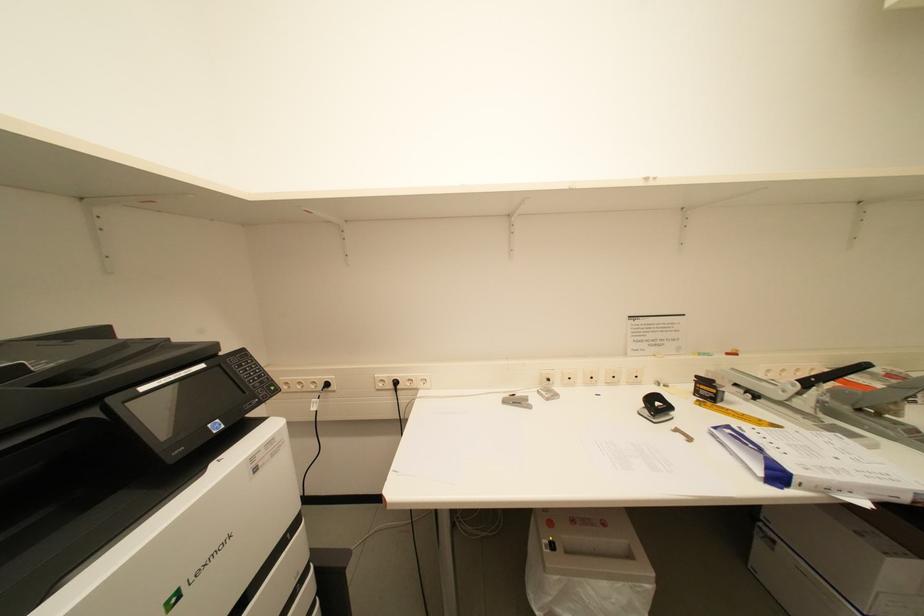
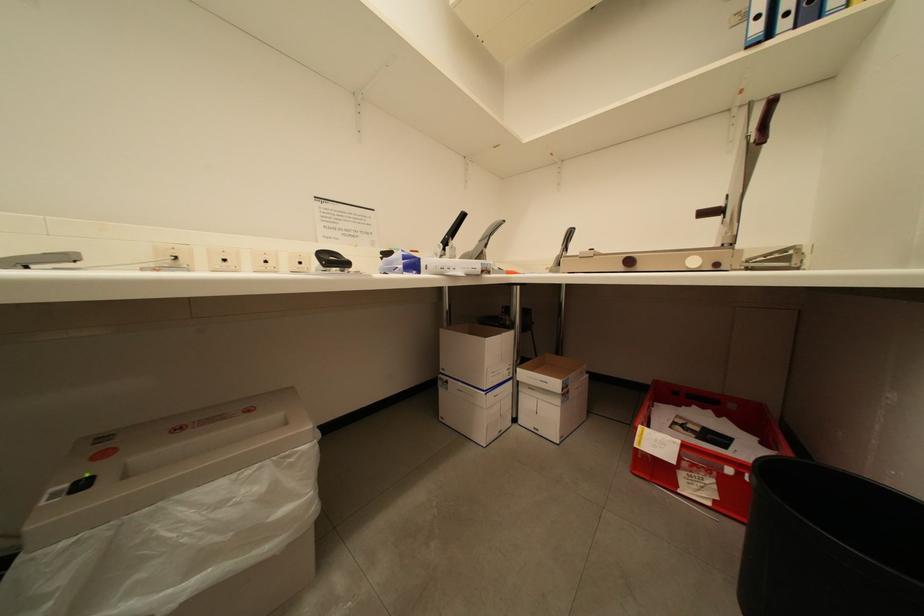
Question: The camera is either moving clockwise (left) or counter-clockwise (right) around the object. The first image is from the beginning of the video and the second image is from the end. Is the camera moving left or right when shooting the video?

Choices:
 (A) Left
 (B) Right

Answer: (A)